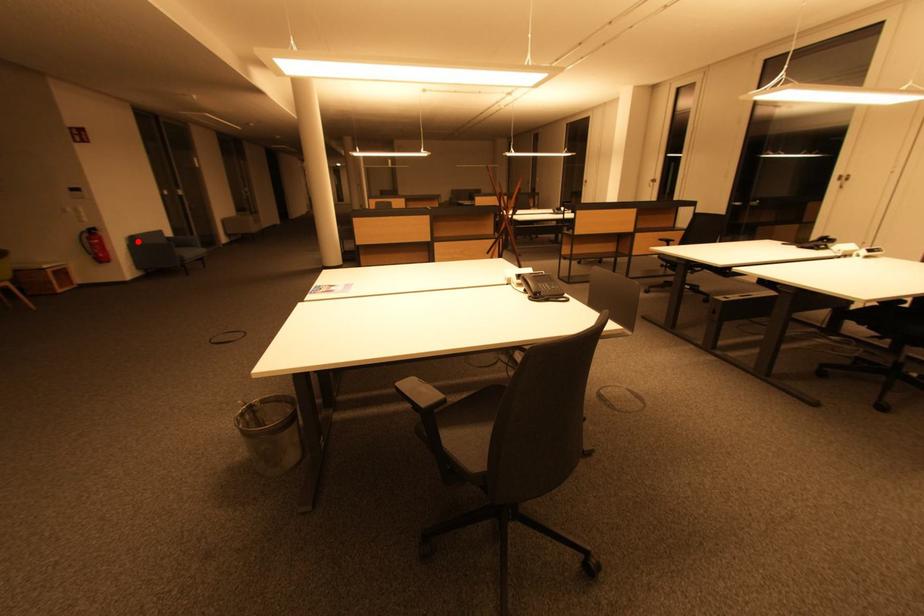
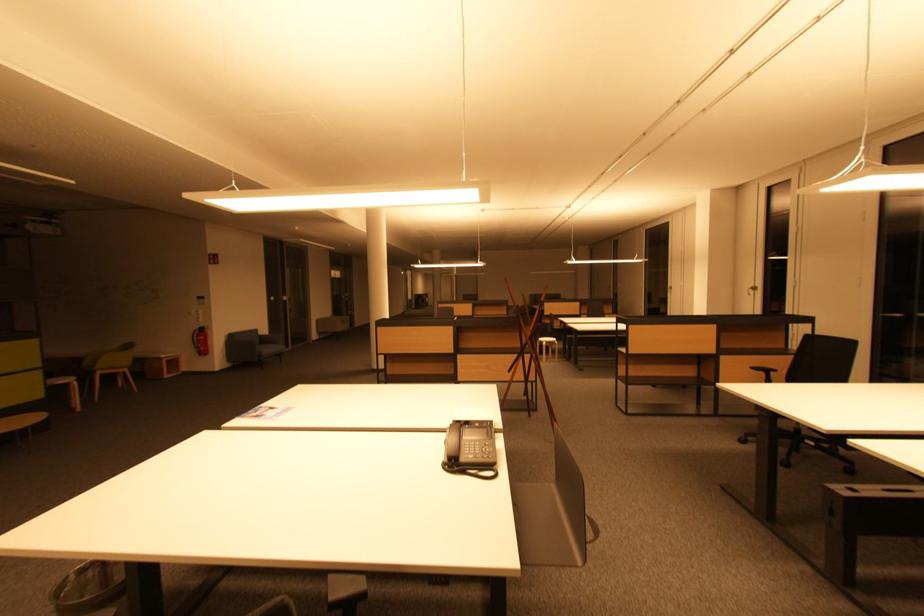
Where in the second image is the point corresponding to the highlighted location from the first image?

(236, 339)